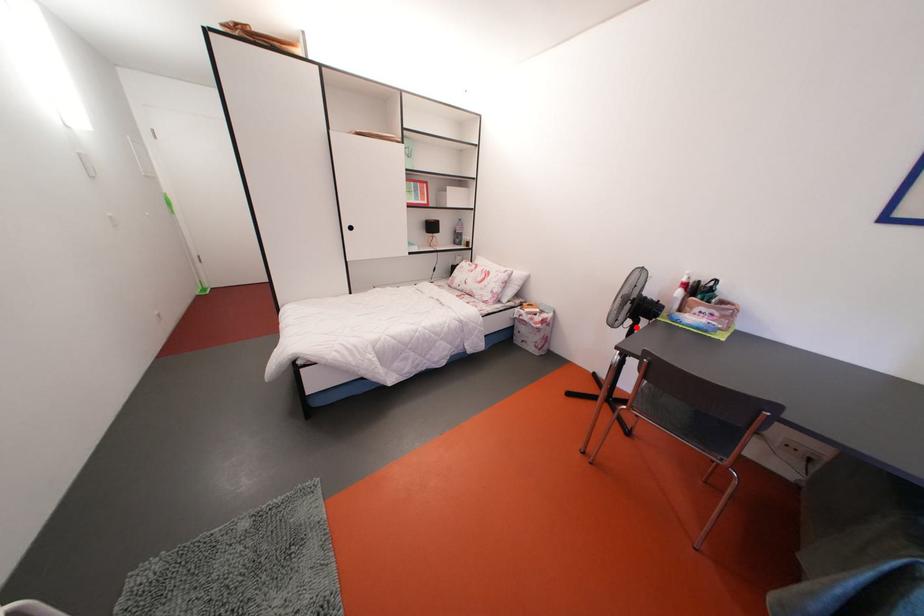
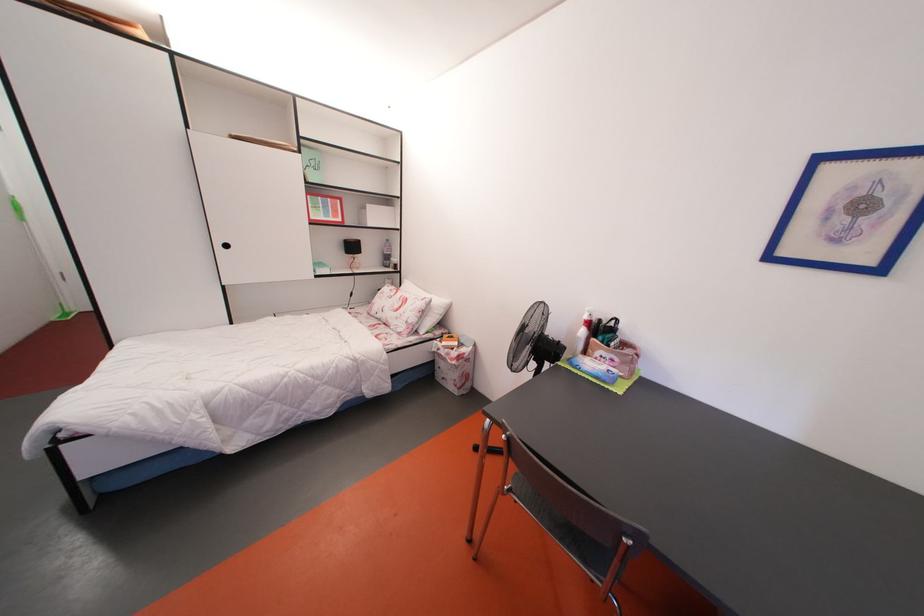
Question: A red point is marked in image1. In image2, is the corresponding 3D point closer to the camera or farther? Reply with the corresponding letter.

Choices:
 (A) The corresponding 3D point is closer.
 (B) The corresponding 3D point is farther.

Answer: (B)